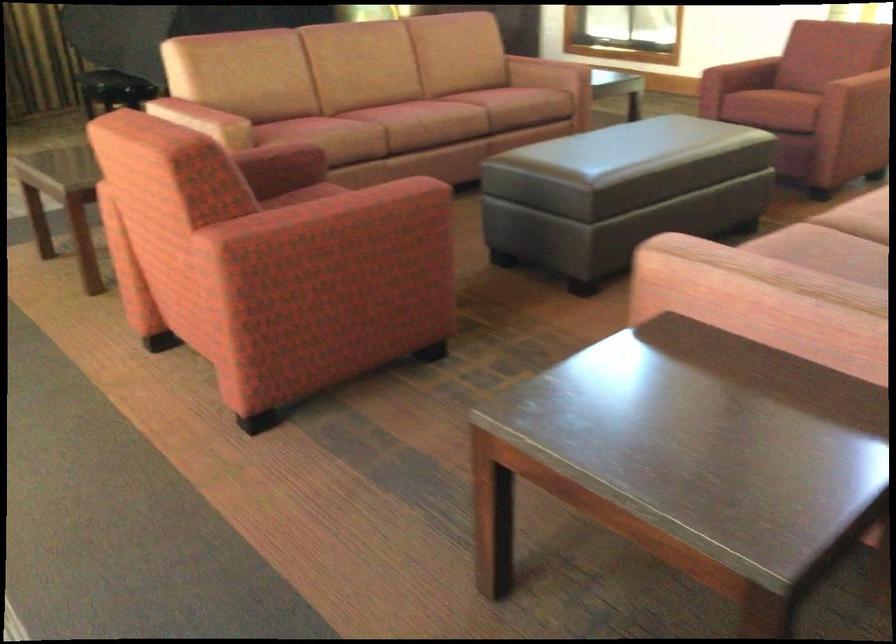
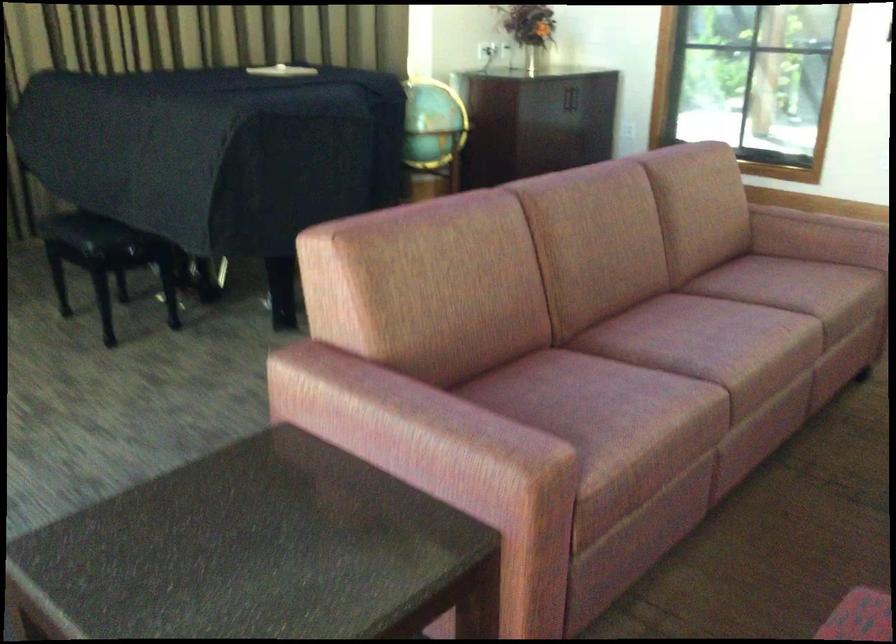
In a continuous first-person perspective shot, in which direction is the camera moving?

The movement direction of the cameraman is left, forward.